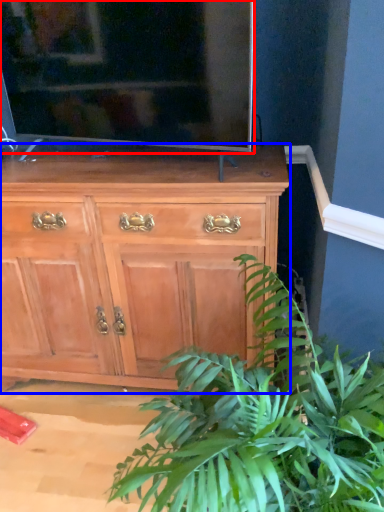
Question: Which point is further to the camera, television (highlighted by a red box) or chest of drawers (highlighted by a blue box)?

Choices:
 (A) television
 (B) chest of drawers

Answer: (B)